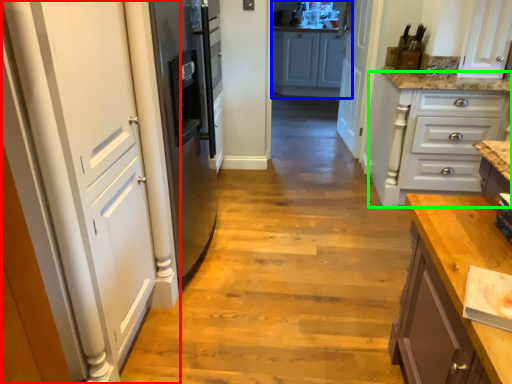
Question: Which object is the closest to the door (highlighted by a red box)? Choose among these: cabinetry (highlighted by a blue box) or cabinetry (highlighted by a green box).

Choices:
 (A) cabinetry
 (B) cabinetry

Answer: (B)